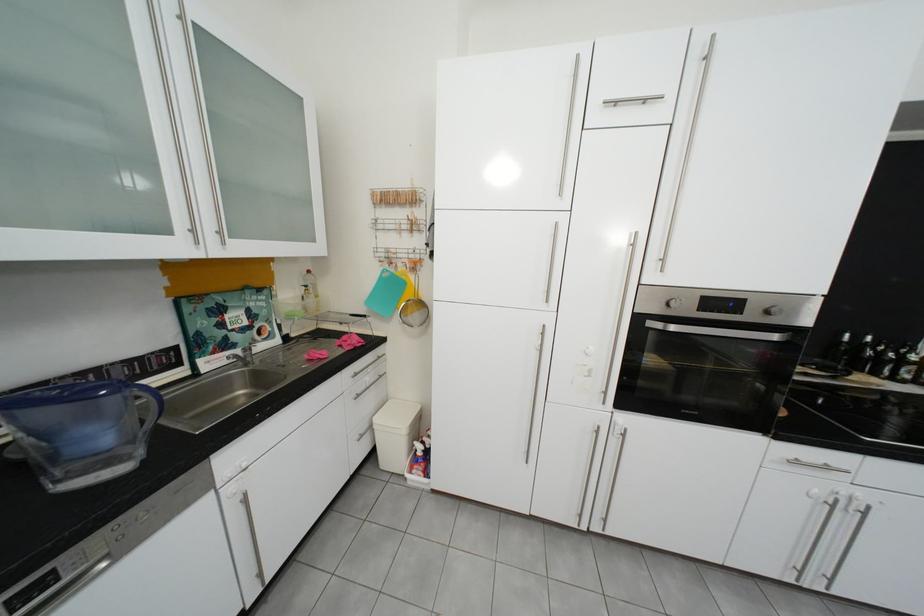
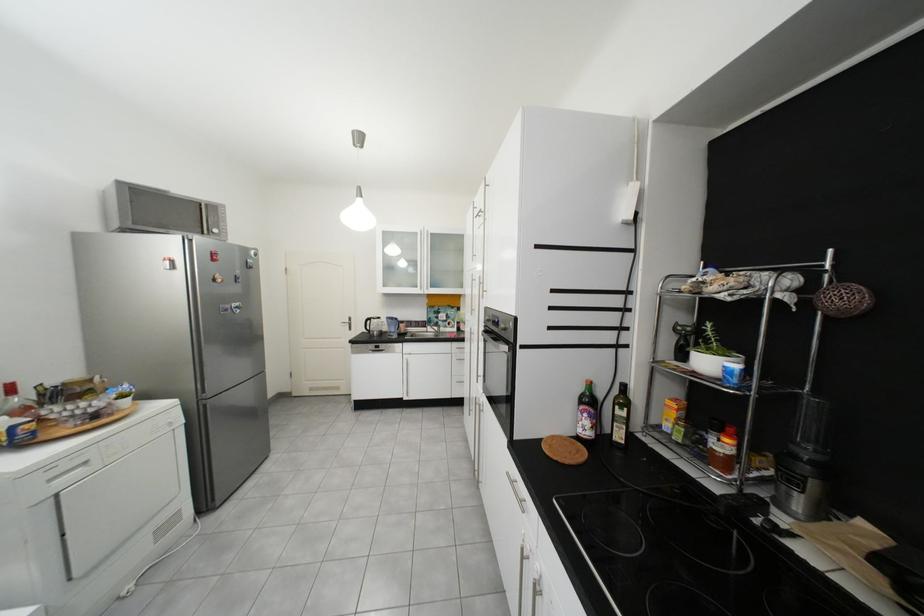
Find the pixel in the second image that matches point 131,374 in the first image.

(426, 325)